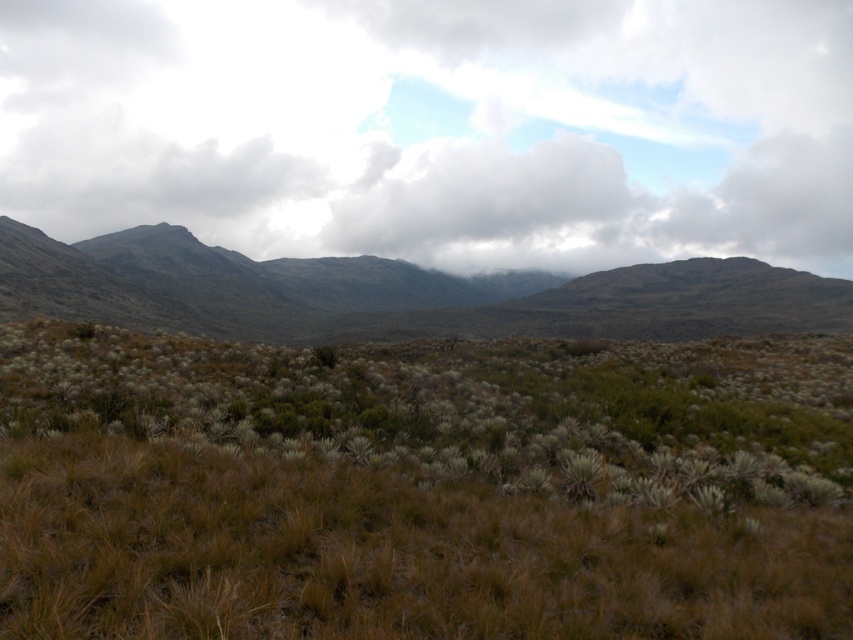
You are standing in the landscape and want to locate the cloudy sky at upper center. According to the coordinates provided, where exactly would you look?

The cloudy sky at upper center is located at coordinates point (438,129).

You are an astronaut on Mars and you see the cloudy sky at upper center and the dark gray rocky mountains at center. Which object takes up more space in the Martian sky?

The cloudy sky at upper center takes up more space in the Martian sky because it is bigger than the dark gray rocky mountains at center.

You are a hiker standing on the brown grassland at center and looking towards the cloudy sky at upper center. Which object is closer to you?

The brown grassland at center is closer to you than the cloudy sky at upper center because it is positioned in front of it.